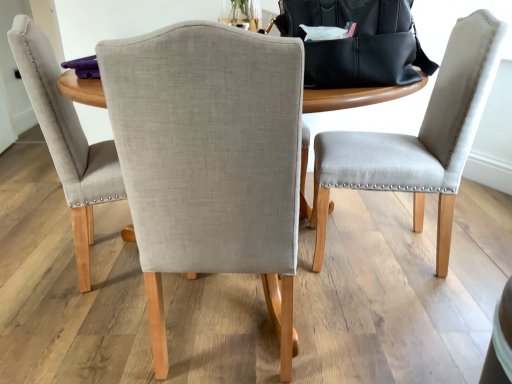
Question: Is black leather messenger bag at upper center to the left of light gray fabric chair at center, the second chair in the right-to-left sequence, from the viewer's perspective?

Choices:
 (A) no
 (B) yes

Answer: (A)

Question: Is black leather messenger bag at upper center outside of light gray fabric chair at center, placed as the second chair when sorted from left to right?

Choices:
 (A) yes
 (B) no

Answer: (A)

Question: Is black leather messenger bag at upper center turned away from light gray fabric chair at center, placed as the second chair when sorted from left to right?

Choices:
 (A) no
 (B) yes

Answer: (A)

Question: From the image's perspective, does black leather messenger bag at upper center appear lower than light gray fabric chair at center, placed as the second chair when sorted from left to right?

Choices:
 (A) yes
 (B) no

Answer: (B)

Question: From a real-world perspective, is black leather messenger bag at upper center below light gray fabric chair at center, placed as the second chair when sorted from left to right?

Choices:
 (A) no
 (B) yes

Answer: (A)

Question: Is black leather messenger bag at upper center surrounding light gray fabric chair at center, placed as the second chair when sorted from left to right?

Choices:
 (A) no
 (B) yes

Answer: (A)

Question: Can light gray fabric chair at center, placed as the second chair when sorted from left to right, be found inside matte gray chair at right, which ranks as the third chair in left-to-right order?

Choices:
 (A) no
 (B) yes

Answer: (A)

Question: Is matte gray chair at right, which ranks as the third chair in left-to-right order, completely or partially outside of light gray fabric chair at center, placed as the second chair when sorted from left to right?

Choices:
 (A) no
 (B) yes

Answer: (B)

Question: Can you confirm if matte gray chair at right, which ranks as the third chair in left-to-right order, is wider than light gray fabric chair at center, placed as the second chair when sorted from left to right?

Choices:
 (A) no
 (B) yes

Answer: (A)

Question: Is matte gray chair at right, which ranks as the third chair in left-to-right order, looking in the opposite direction of light gray fabric chair at center, placed as the second chair when sorted from left to right?

Choices:
 (A) no
 (B) yes

Answer: (A)

Question: Can you confirm if matte gray chair at right, which ranks as the third chair in left-to-right order, is shorter than light gray fabric chair at center, placed as the second chair when sorted from left to right?

Choices:
 (A) yes
 (B) no

Answer: (B)

Question: Is matte gray chair at right, which ranks as the third chair in left-to-right order, smaller than light gray fabric chair at center, the second chair in the right-to-left sequence?

Choices:
 (A) yes
 (B) no

Answer: (A)

Question: Does black leather messenger bag at upper center contain light gray fabric chair at center, the 1th chair viewed from the left?

Choices:
 (A) yes
 (B) no

Answer: (B)